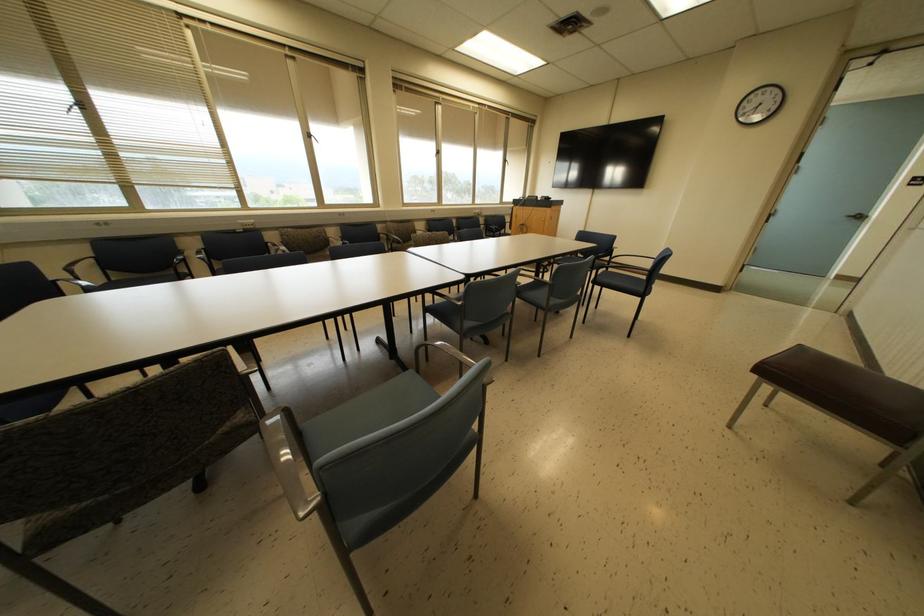
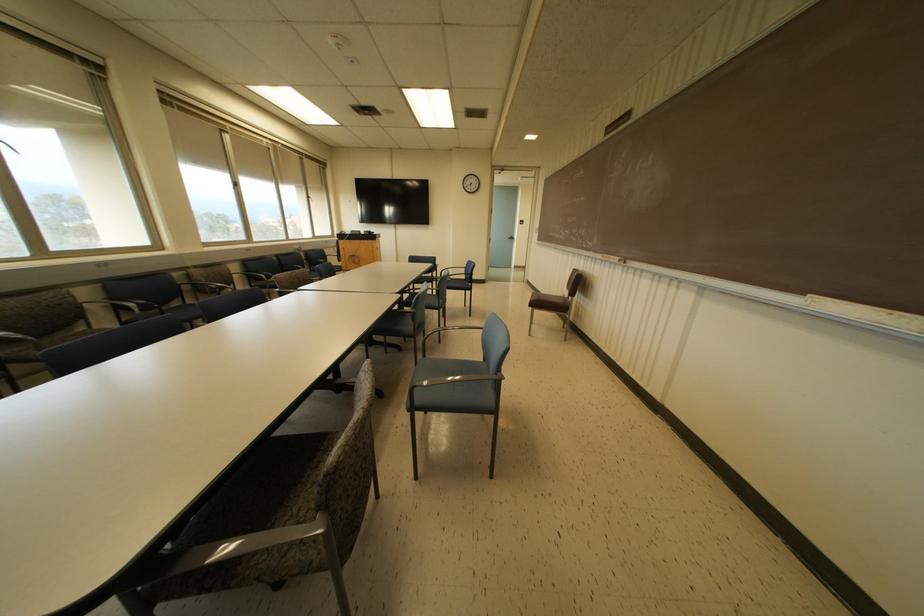
In the second image, find the point that corresponds to point (641, 294) in the first image.

(468, 288)